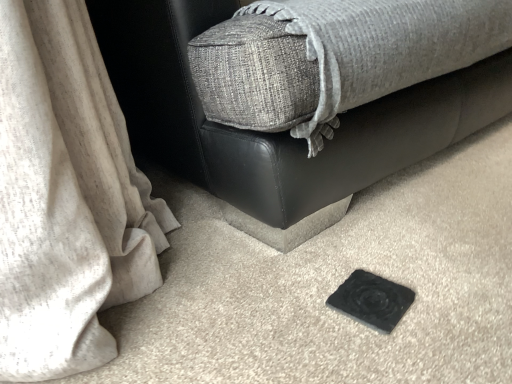
What are the coordinates of `free space in front of black rubber pad at lower center` in the screenshot? It's located at (388, 349).